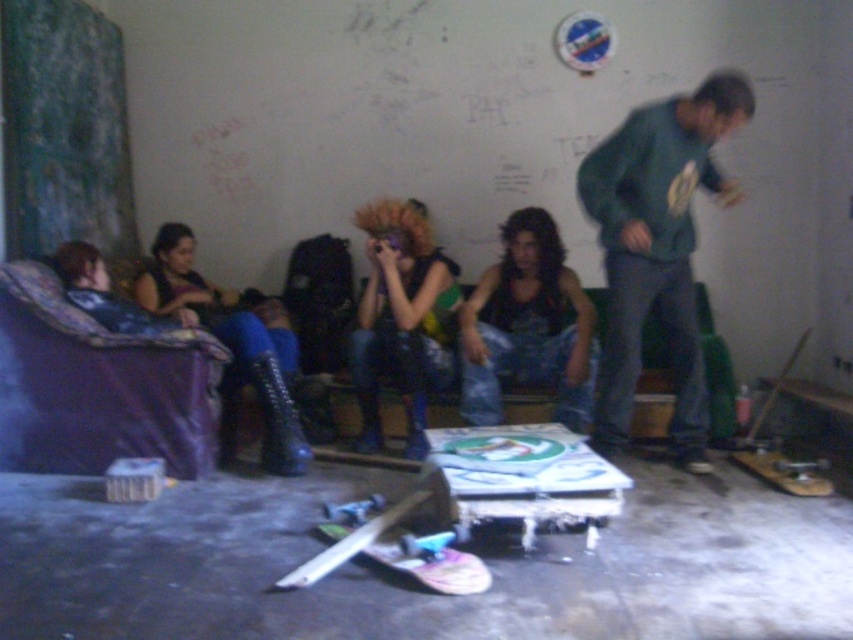
You are standing in the room and want to pick up the green matte sweatshirt at right. Based on its coordinates, where exactly should you look to find it?

The green matte sweatshirt at right is located at point [659,248], so you should look towards the lower right area of the room to find it.